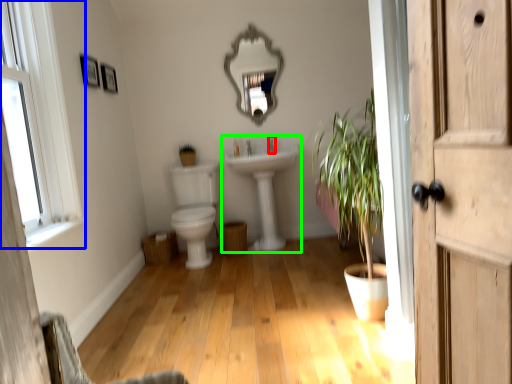
Question: Estimate the real-world distances between objects in this image. Which object is closer to faucet (highlighted by a red box), window (highlighted by a blue box) or sink (highlighted by a green box)?

Choices:
 (A) window
 (B) sink

Answer: (B)